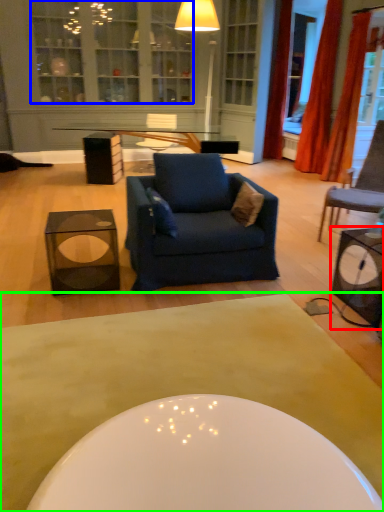
Question: Based on their relative distances, which object is nearer to table (highlighted by a red box)? Choose from cabinetry (highlighted by a blue box) and coffee table (highlighted by a green box).

Choices:
 (A) cabinetry
 (B) coffee table

Answer: (B)